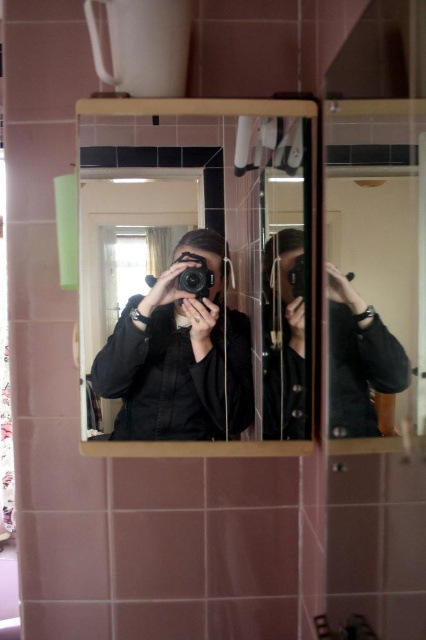
Locate an element on the screen. black glossy mirror at center is located at coordinates (189, 266).

Can you confirm if black glossy mirror at center is positioned above black matte camera at right?

Yes.

Describe the element at coordinates (189, 266) in the screenshot. I see `black glossy mirror at center` at that location.

This screenshot has height=640, width=426. I want to click on black glossy mirror at center, so click(x=189, y=266).

Which of these two, black matte camera at right or black matte camera at center, stands taller?

black matte camera at center is taller.

Who is more forward, (x=330, y=340) or (x=299, y=241)?

Point (x=330, y=340)

Which is in front, point (353, 429) or point (307, 429)?

Point (353, 429) is in front.

Find the location of a particular element. black matte camera at right is located at coordinates (359, 360).

Is point (222, 385) closer to viewer compared to point (196, 301)?

That is False.

Between black glossy mirror at center and matte black jacket at center, which one has more height?

Standing taller between the two is black glossy mirror at center.

Which is in front, point (244, 337) or point (221, 324)?

Point (221, 324)

Locate an element on the screen. black glossy mirror at center is located at coordinates [x=189, y=266].